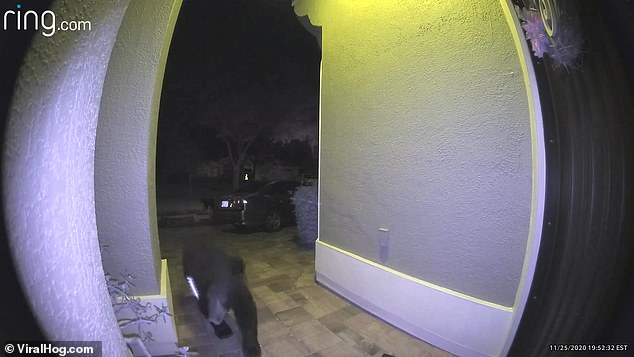
At what (x,y) coordinates should I click in order to perform the action: click on dark brown door. Please return your answer as a coordinate pair (x, y). Image resolution: width=634 pixels, height=357 pixels. Looking at the image, I should click on (593, 191).